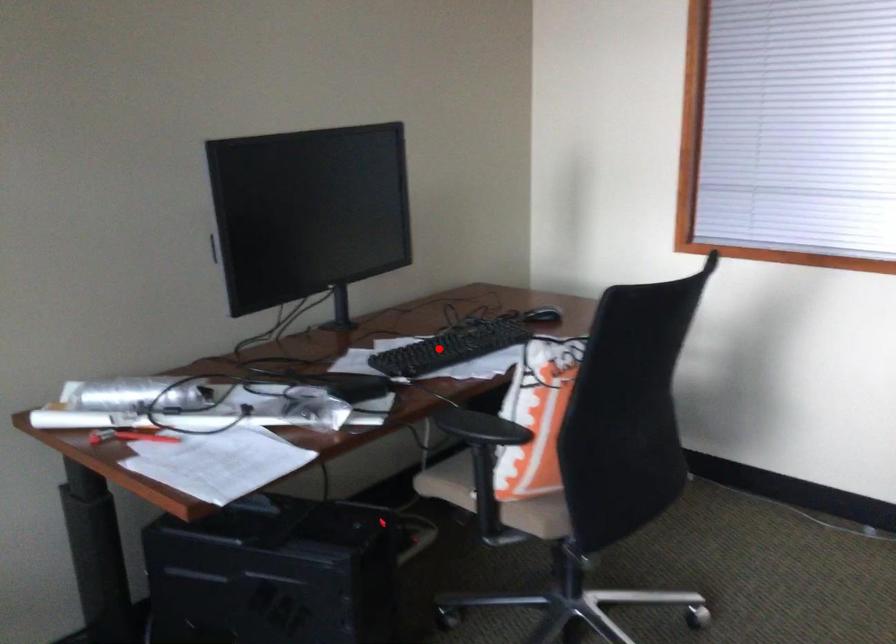
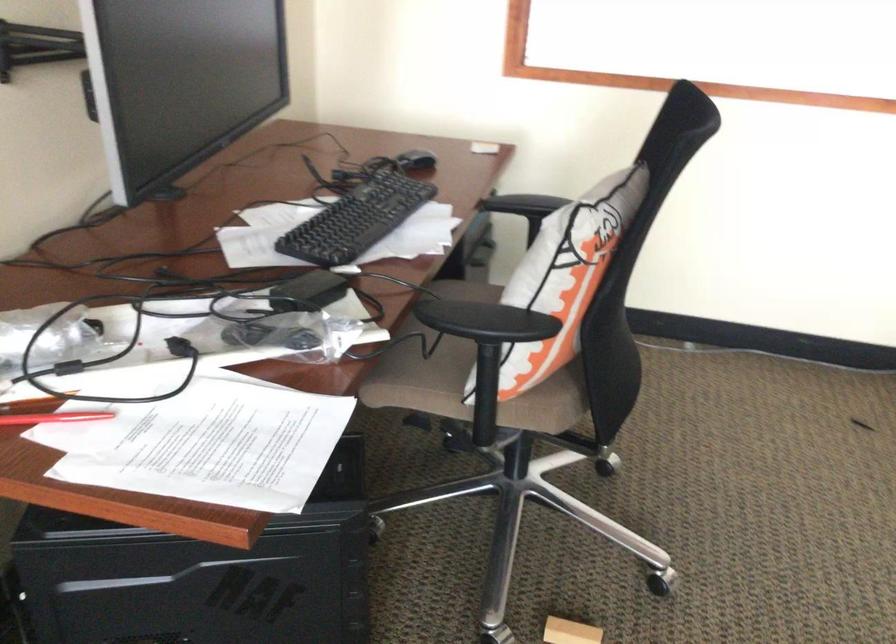
The point at the highlighted location is marked in the first image. Where is the corresponding point in the second image?

(356, 220)